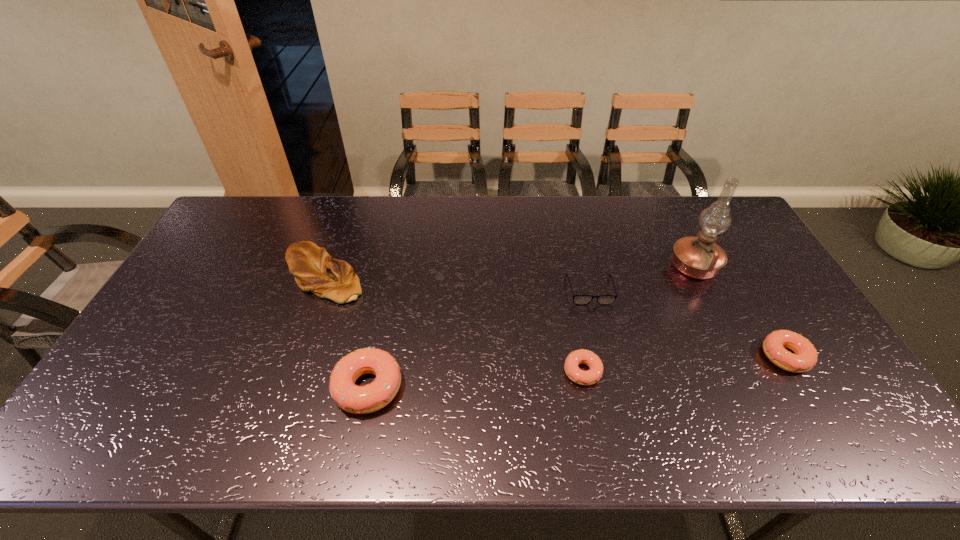
Please point a free position for a doughnut on the left. Please provide its 2D coordinates. Your answer should be formatted as a tuple, i.e. [(x, y)], where the tuple contains the x and y coordinates of a point satisfying the conditions above.

[(140, 404)]